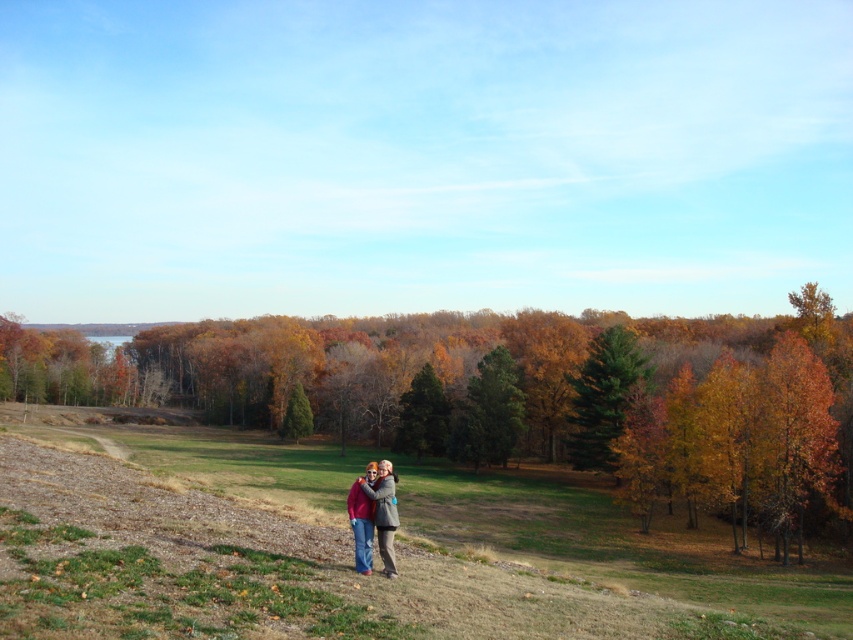
Question: From the image, what is the correct spatial relationship of green matte tree at center-right in relation to green matte tree at center?

Choices:
 (A) above
 (B) below

Answer: (A)

Question: Where is brown matte tree at center located in relation to green matte tree at center in the image?

Choices:
 (A) right
 (B) left

Answer: (B)

Question: Which point appears farthest from the camera in this image?

Choices:
 (A) (593, 362)
 (B) (463, 433)

Answer: (B)

Question: Does green matte tree at center come in front of matte pink sweater at center?

Choices:
 (A) no
 (B) yes

Answer: (A)

Question: Which of the following is the closest to the observer?

Choices:
 (A) (386, 499)
 (B) (425, 406)
 (C) (485, 419)
 (D) (618, 403)

Answer: (A)

Question: Based on their relative distances, which object is farther from the brown matte tree at center?

Choices:
 (A) green matte tree at center-right
 (B) matte pink sweater at center

Answer: (B)